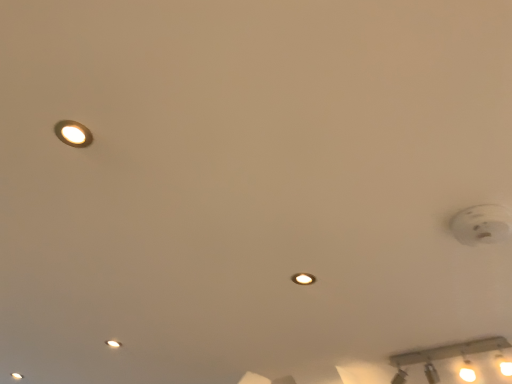
The image size is (512, 384). What are the coordinates of `matte white lamp at lower right` in the screenshot? It's located at (443, 355).

What do you see at coordinates (443, 355) in the screenshot? I see `matte white lamp at lower right` at bounding box center [443, 355].

You are a GUI agent. You are given a task and a screenshot of the screen. Output one action in this format:
    pyautogui.click(x=<x>, y=<y>)
    Task: Click on the matte white lamp at lower right
    Image resolution: width=512 pixels, height=384 pixels.
    Given the screenshot: What is the action you would take?
    pyautogui.click(x=443, y=355)